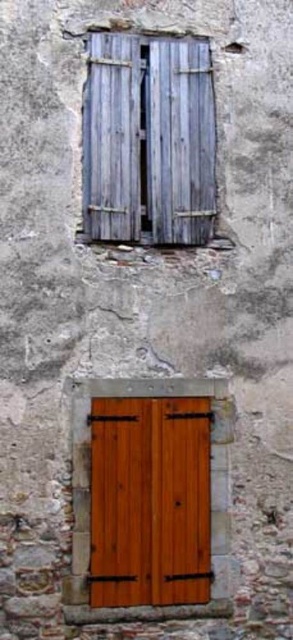
You are an architect analyzing the placement of the weathered wood shutters at upper center in the image. What are their exact coordinates in the 2D plane?

The weathered wood shutters at upper center are located at coordinates point (x=149, y=140).

You are a delivery person trying to enter the building through the wooden door at center. There are weathered wood shutters at upper center above the door. Can you see the door handle from below the shutters?

The weathered wood shutters at upper center is positioned over wooden door at center, so the shutters are blocking the view of the door handle from below.

You are standing in front of a stone wall with two features. You need to locate the wooden door at center. Which direction should you turn to face the weathered wood shutters at upper center?

The weathered wood shutters at upper center are to the left of the wooden door at center, so you should turn to your left to face them.